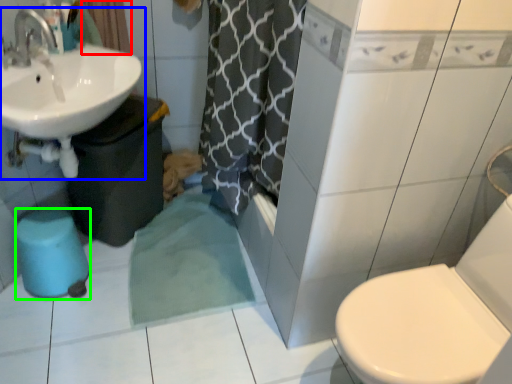
Question: Considering the real-world distances, which object is farthest from curtain (highlighted by a red box)? sink (highlighted by a blue box) or bidet (highlighted by a green box)?

Choices:
 (A) sink
 (B) bidet

Answer: (B)